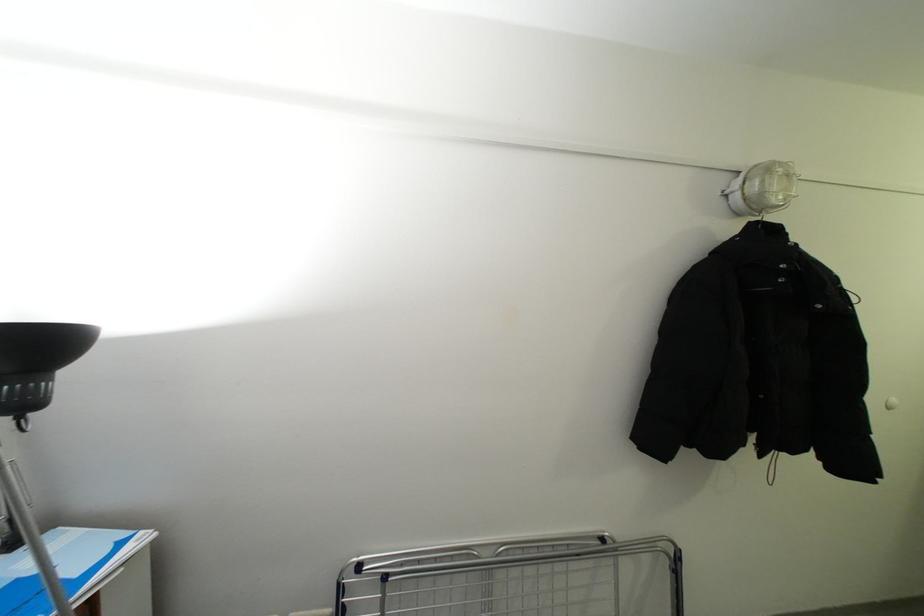
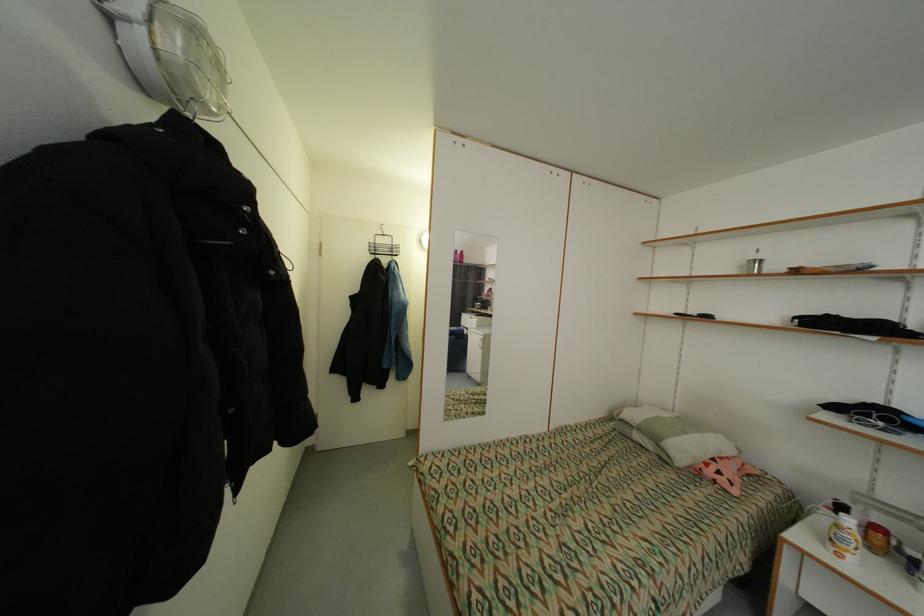
Question: The first image is from the beginning of the video and the second image is from the end. How did the camera likely rotate when shooting the video?

Choices:
 (A) Left
 (B) Right
 (C) Up
 (D) Down

Answer: (B)